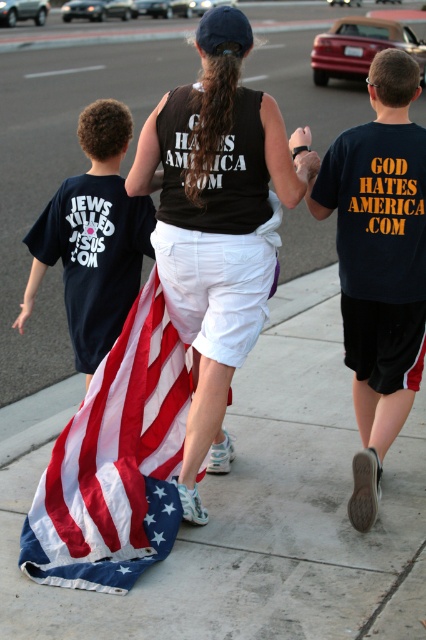
Question: Which of these objects is positioned closest to the dark blue t-shirt at right?

Choices:
 (A) american flag at center
 (B) matte black tank top at center
 (C) dark blue t-shirt at left

Answer: (B)

Question: Can you confirm if american flag at center is wider than dark blue t-shirt at left?

Choices:
 (A) yes
 (B) no

Answer: (B)

Question: Which point is farther to the camera?

Choices:
 (A) matte black hand at center
 (B) matte black tank top at center
 (C) dark blue t-shirt at left

Answer: (C)

Question: Observing the image, what is the correct spatial positioning of dark blue t-shirt at left in reference to matte black hand at center?

Choices:
 (A) right
 (B) left

Answer: (B)

Question: Is american flag at center wider than matte black hand at center?

Choices:
 (A) no
 (B) yes

Answer: (B)

Question: Which point is farther from the camera taking this photo?

Choices:
 (A) (146, 118)
 (B) (417, 180)
 (C) (307, 166)
 (D) (120, 259)

Answer: (A)